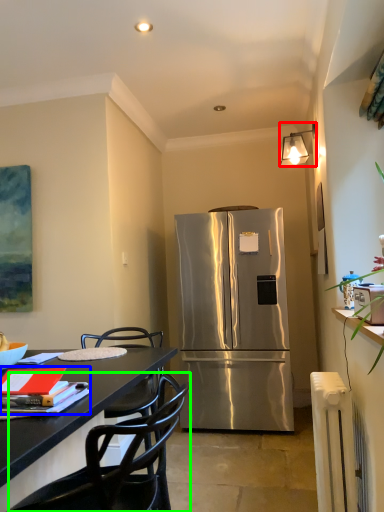
Question: Which object is positioned farthest from lamp (highlighted by a red box)? Select from book (highlighted by a blue box) and chair (highlighted by a green box).

Choices:
 (A) book
 (B) chair

Answer: (B)